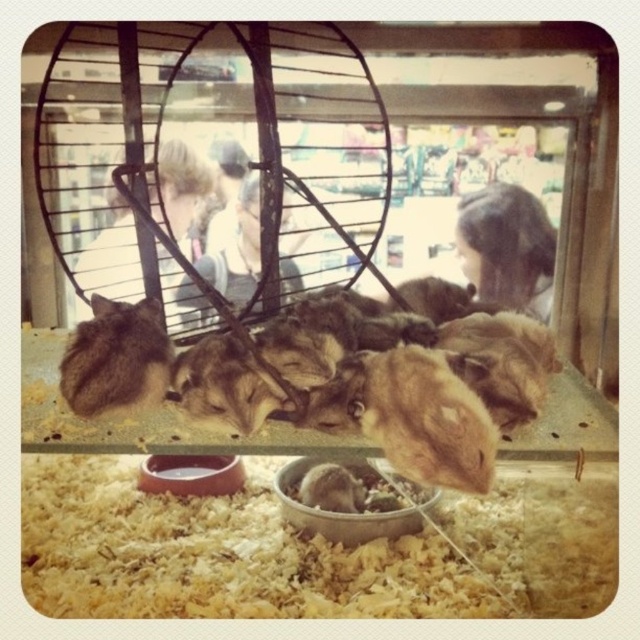
Can you confirm if brown fluffy hamster at center is positioned to the right of fuzzy brown fur at lower left?

Yes, brown fluffy hamster at center is to the right of fuzzy brown fur at lower left.

Based on the photo, which of these two, brown fluffy hamster at center or fuzzy brown fur at lower left, stands shorter?

fuzzy brown fur at lower left is shorter.

I want to click on brown fluffy hamster at center, so click(x=163, y=369).